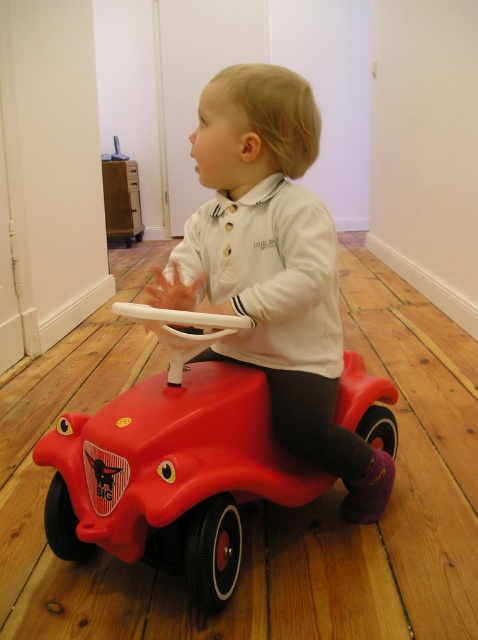
Question: Among these objects, which one is nearest to the camera?

Choices:
 (A) matte plastic child at center
 (B) rubberized matte red toy car at center

Answer: (B)

Question: Which object is closer to the camera taking this photo?

Choices:
 (A) matte plastic child at center
 (B) rubberized matte red toy car at center

Answer: (B)

Question: Which object is closer to the camera taking this photo?

Choices:
 (A) matte plastic child at center
 (B) rubberized matte red toy car at center

Answer: (B)

Question: Where is rubberized matte red toy car at center located in relation to matte plastic child at center in the image?

Choices:
 (A) left
 (B) right

Answer: (A)

Question: Does rubberized matte red toy car at center appear over matte plastic child at center?

Choices:
 (A) no
 (B) yes

Answer: (A)

Question: Does rubberized matte red toy car at center have a greater width compared to matte plastic child at center?

Choices:
 (A) no
 (B) yes

Answer: (B)